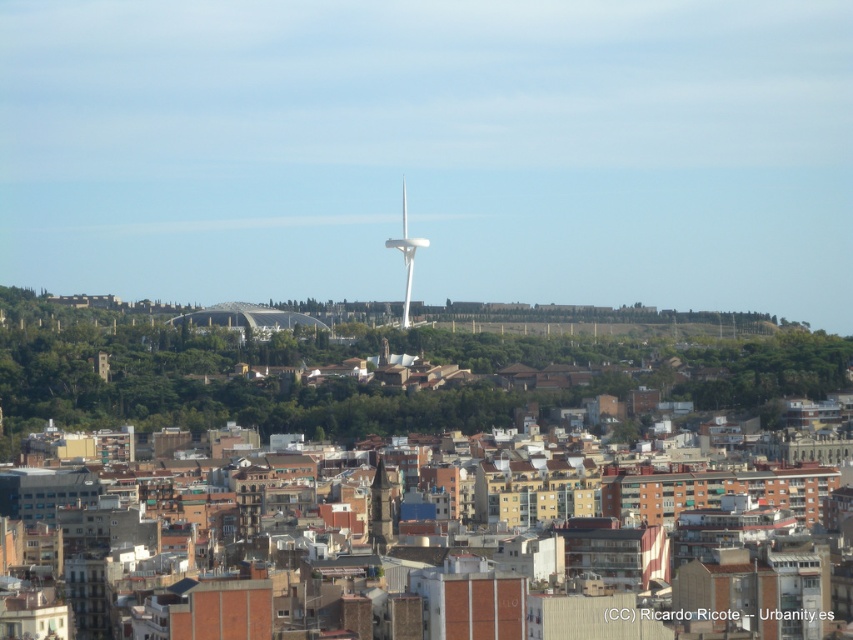
Is dark brown stone tower at center positioned in front of white smooth wind turbine at center?

Yes, it is in front of white smooth wind turbine at center.

Does dark brown stone tower at center appear under white smooth wind turbine at center?

Correct, dark brown stone tower at center is located below white smooth wind turbine at center.

The image size is (853, 640). Describe the element at coordinates (380, 509) in the screenshot. I see `dark brown stone tower at center` at that location.

Locate an element on the screen. The width and height of the screenshot is (853, 640). dark brown stone tower at center is located at coordinates (380, 509).